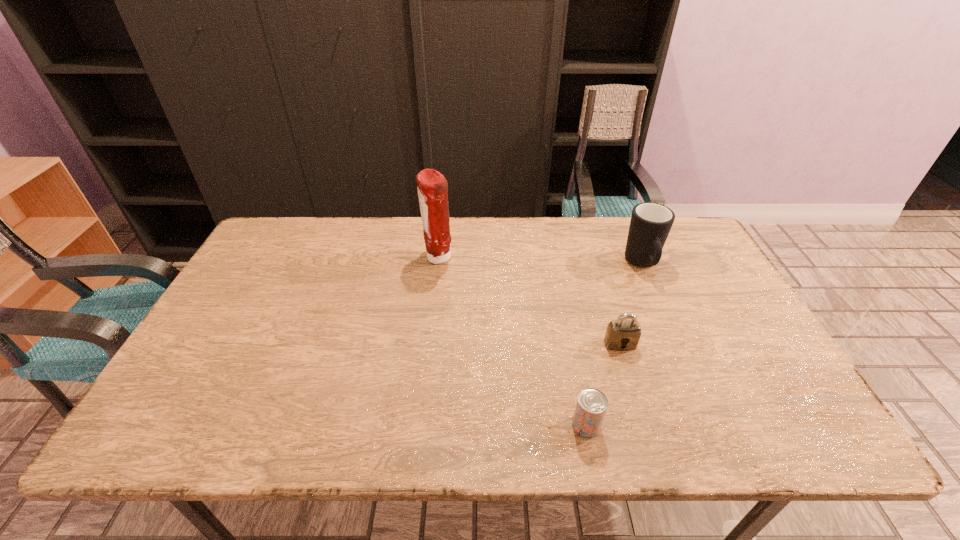
Where is `free space between the shortest object and the condiment`? This screenshot has width=960, height=540. free space between the shortest object and the condiment is located at coordinates (512, 342).

Find the location of a particular element. free space between the third farthest object and the rightmost object is located at coordinates (632, 305).

Locate an element on the screen. free spot between the shortest object and the tallest object is located at coordinates (512, 342).

Where is `free space between the second tallest object and the second object from right to left`? This screenshot has height=540, width=960. free space between the second tallest object and the second object from right to left is located at coordinates (632, 305).

Find the location of `object identified as the second closest to the mug`. object identified as the second closest to the mug is located at coordinates (591, 406).

The height and width of the screenshot is (540, 960). In order to click on object identified as the third closest to the third object from right to left in this screenshot , I will do `click(432, 187)`.